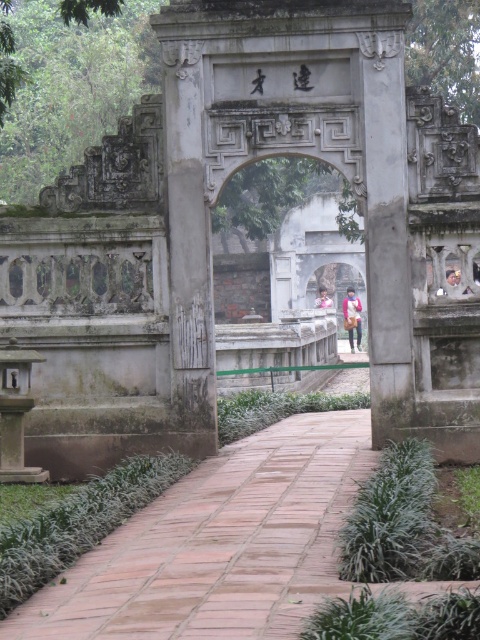
You are standing in front of the traditional Chinese stone archway and see a matte brown jacket at center and a pink fabric at center. Which object is positioned to the right side from your perspective?

The matte brown jacket at center is to the right of the pink fabric at center.

You are a tour guide leading a group to a historical site. You want to ensure that your visitors can hear you clearly while standing between the smooth stone lantern at left and the matte brown jacket at center. If your voice can carry up to 150 feet, will everyone hear you?

The distance between the smooth stone lantern at left and the matte brown jacket at center is 126.37 feet, which is within the 150 feet range your voice can carry. Therefore, everyone should be able to hear you clearly.